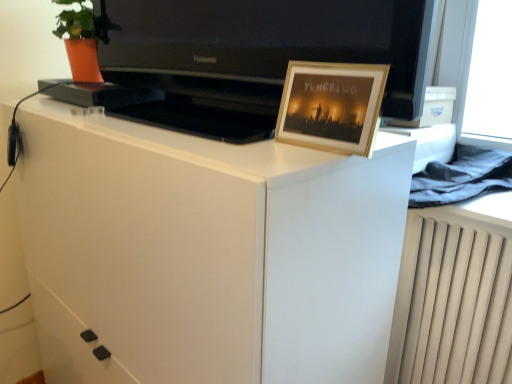
Question: Is black glossy television at upper center closer to camera compared to white glossy cabinet at center?

Choices:
 (A) no
 (B) yes

Answer: (B)

Question: Is black glossy television at upper center positioned with its back to white glossy cabinet at center?

Choices:
 (A) no
 (B) yes

Answer: (A)

Question: Can you confirm if black glossy television at upper center is shorter than white glossy cabinet at center?

Choices:
 (A) yes
 (B) no

Answer: (A)

Question: Is black glossy television at upper center taller than white glossy cabinet at center?

Choices:
 (A) no
 (B) yes

Answer: (A)

Question: Would you say black glossy television at upper center contains white glossy cabinet at center?

Choices:
 (A) yes
 (B) no

Answer: (B)

Question: Is wooden picture frame at upper right spatially inside white glossy cabinet at center, or outside of it?

Choices:
 (A) outside
 (B) inside

Answer: (A)

Question: Considering their positions, is wooden picture frame at upper right located in front of or behind white glossy cabinet at center?

Choices:
 (A) front
 (B) behind

Answer: (B)

Question: From a real-world perspective, is wooden picture frame at upper right physically located above or below white glossy cabinet at center?

Choices:
 (A) below
 (B) above

Answer: (B)

Question: In terms of width, does wooden picture frame at upper right look wider or thinner when compared to white glossy cabinet at center?

Choices:
 (A) thin
 (B) wide

Answer: (A)

Question: Based on their sizes in the image, would you say white glossy cabinet at center is bigger or smaller than wooden picture frame at upper right?

Choices:
 (A) small
 (B) big

Answer: (B)

Question: From a real-world perspective, is white glossy cabinet at center positioned above or below wooden picture frame at upper right?

Choices:
 (A) below
 (B) above

Answer: (A)

Question: Is white glossy cabinet at center wider or thinner than wooden picture frame at upper right?

Choices:
 (A) wide
 (B) thin

Answer: (A)

Question: Is white glossy cabinet at center in front of or behind wooden picture frame at upper right in the image?

Choices:
 (A) behind
 (B) front

Answer: (B)

Question: From the image's perspective, is black glossy television at upper center located above or below white glossy cabinet at center?

Choices:
 (A) below
 (B) above

Answer: (B)

Question: From a real-world perspective, is black glossy television at upper center positioned above or below white glossy cabinet at center?

Choices:
 (A) above
 (B) below

Answer: (A)